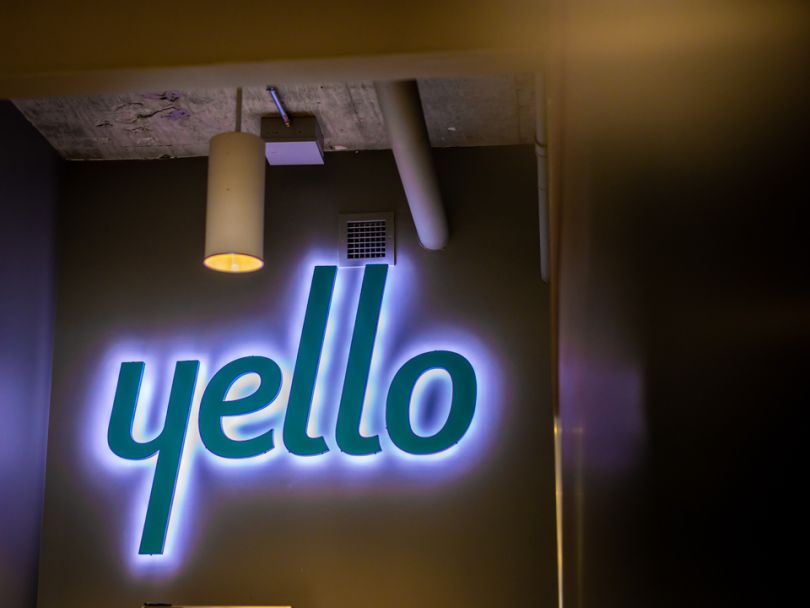
The image size is (810, 608). I want to click on blue painted wall, so click(16, 435).